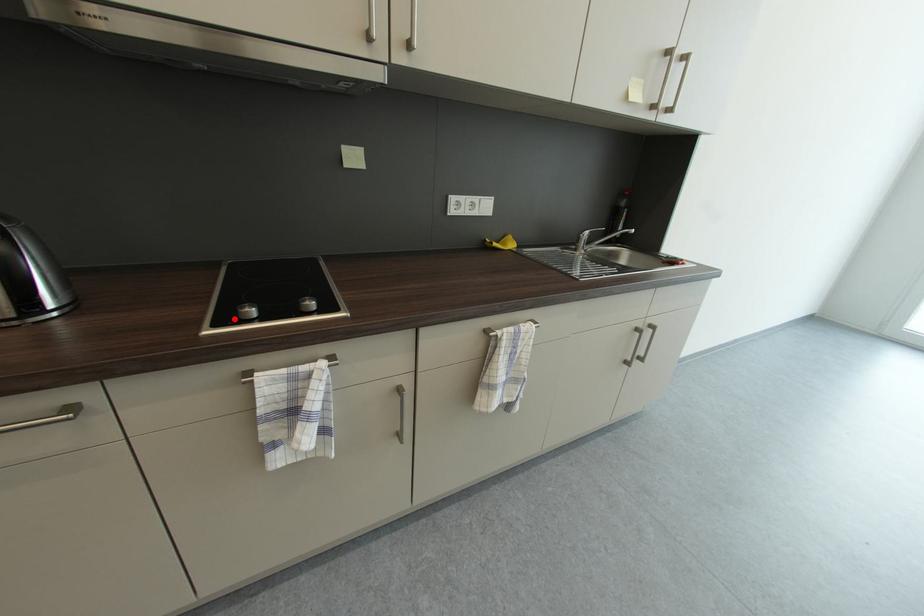
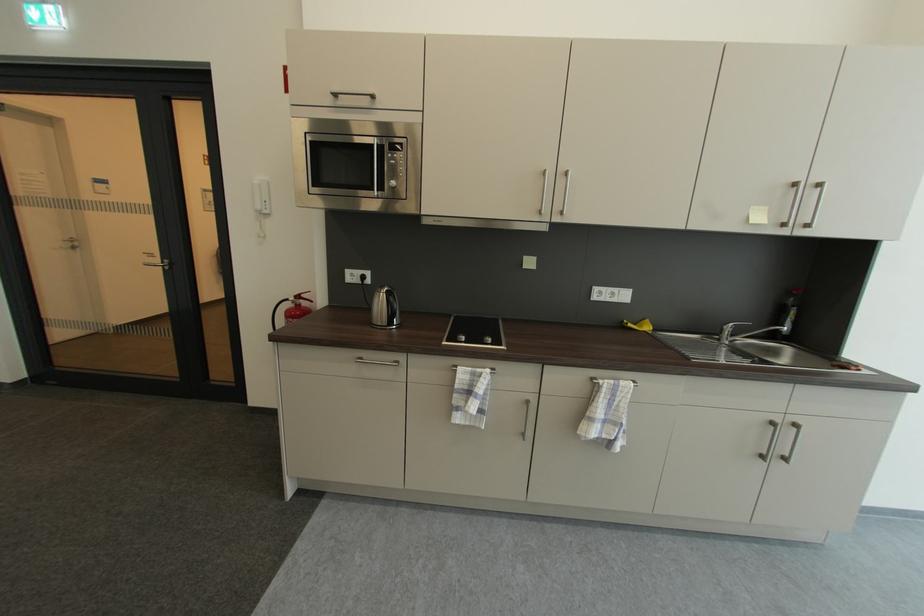
Question: I am providing you with two images of the same scene from different viewpoints. A red point is marked on the first image. Can you still see the location of the red point in image 2?

Choices:
 (A) Yes
 (B) No

Answer: (A)